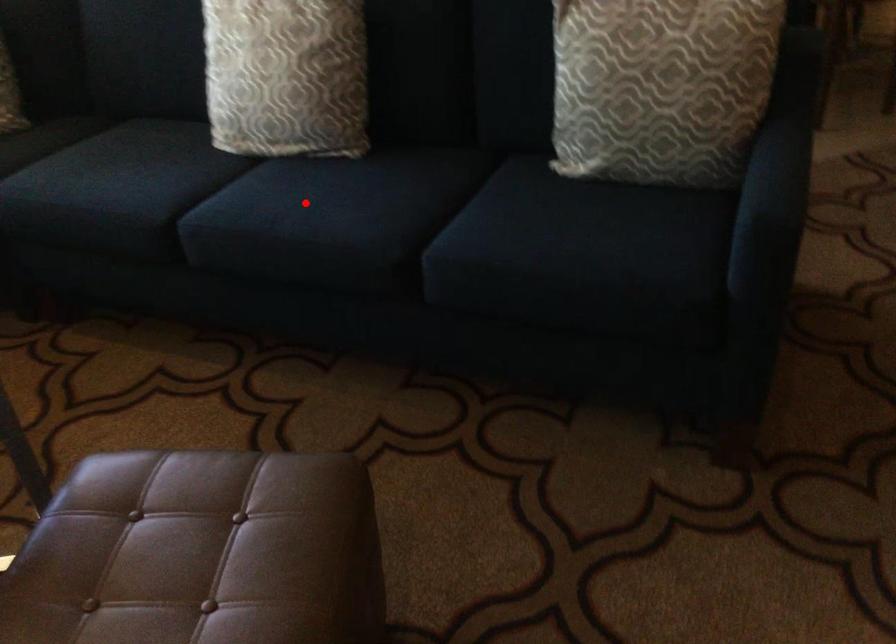
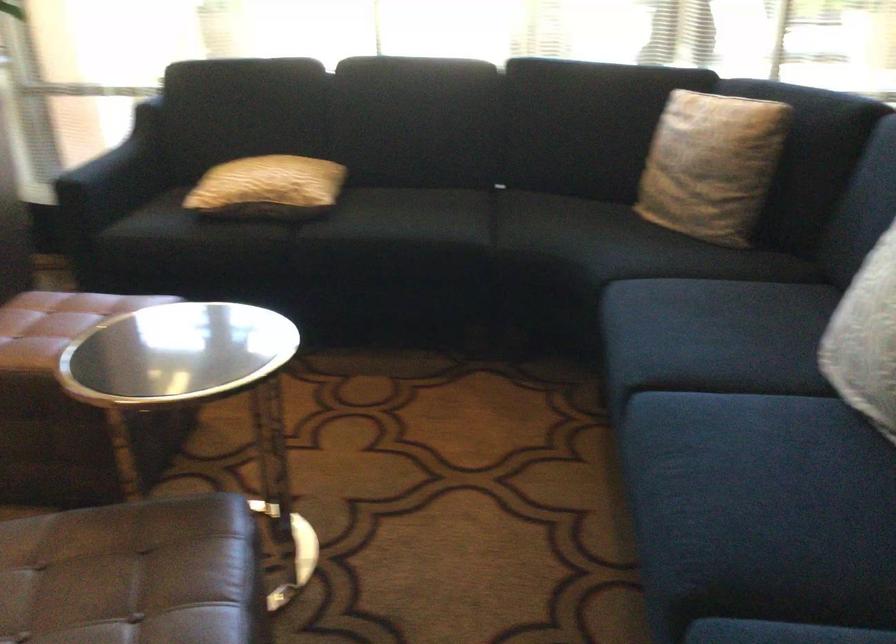
Question: I am providing you with two images of the same scene from different viewpoints. A red point is shown in image1. For the corresponding object point in image2, is it positioned nearer or farther from the camera?

Choices:
 (A) Nearer
 (B) Farther

Answer: (A)